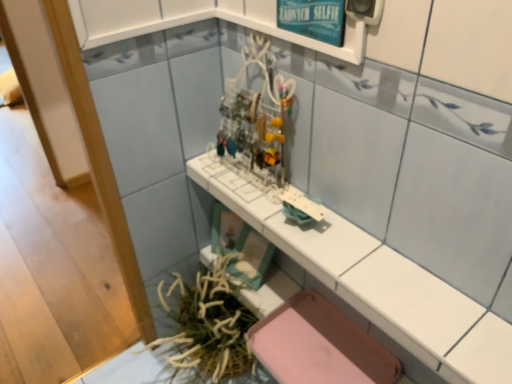
Question: From the image's perspective, does teal glossy signboard at upper center appear lower than white glossy counter top at center?

Choices:
 (A) yes
 (B) no

Answer: (B)

Question: Could you tell me if teal glossy signboard at upper center is turned towards white glossy counter top at center?

Choices:
 (A) yes
 (B) no

Answer: (B)

Question: Is teal glossy signboard at upper center positioned far away from white glossy counter top at center?

Choices:
 (A) yes
 (B) no

Answer: (B)

Question: Can you confirm if teal glossy signboard at upper center is thinner than white glossy counter top at center?

Choices:
 (A) no
 (B) yes

Answer: (B)

Question: Does teal glossy signboard at upper center lie in front of white glossy counter top at center?

Choices:
 (A) no
 (B) yes

Answer: (A)

Question: Is point (184, 352) closer or farther from the camera than point (292, 36)?

Choices:
 (A) closer
 (B) farther

Answer: (B)

Question: From the image's perspective, is green leafy plant at lower left located above or below teal glossy signboard at upper center?

Choices:
 (A) below
 (B) above

Answer: (A)

Question: Would you say green leafy plant at lower left is to the left or to the right of teal glossy signboard at upper center in the picture?

Choices:
 (A) right
 (B) left

Answer: (B)

Question: Is green leafy plant at lower left inside or outside of teal glossy signboard at upper center?

Choices:
 (A) inside
 (B) outside

Answer: (B)

Question: Considering their positions, is green leafy plant at lower left located in front of or behind white glossy counter top at center?

Choices:
 (A) behind
 (B) front

Answer: (A)

Question: Considering the relative positions of green leafy plant at lower left and white glossy counter top at center in the image provided, is green leafy plant at lower left to the left or to the right of white glossy counter top at center?

Choices:
 (A) right
 (B) left

Answer: (B)

Question: From the image's perspective, is green leafy plant at lower left located above or below white glossy counter top at center?

Choices:
 (A) below
 (B) above

Answer: (A)

Question: Which is correct: green leafy plant at lower left is inside white glossy counter top at center, or outside of it?

Choices:
 (A) inside
 (B) outside

Answer: (B)

Question: Choose the correct answer: Is white glossy counter top at center inside green leafy plant at lower left or outside it?

Choices:
 (A) inside
 (B) outside

Answer: (B)

Question: In terms of height, does white glossy counter top at center look taller or shorter compared to green leafy plant at lower left?

Choices:
 (A) short
 (B) tall

Answer: (A)